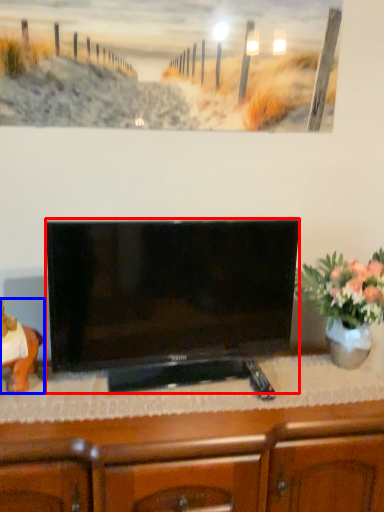
Question: Which object is closer to the camera taking this photo, television (highlighted by a red box) or animal (highlighted by a blue box)?

Choices:
 (A) television
 (B) animal

Answer: (A)